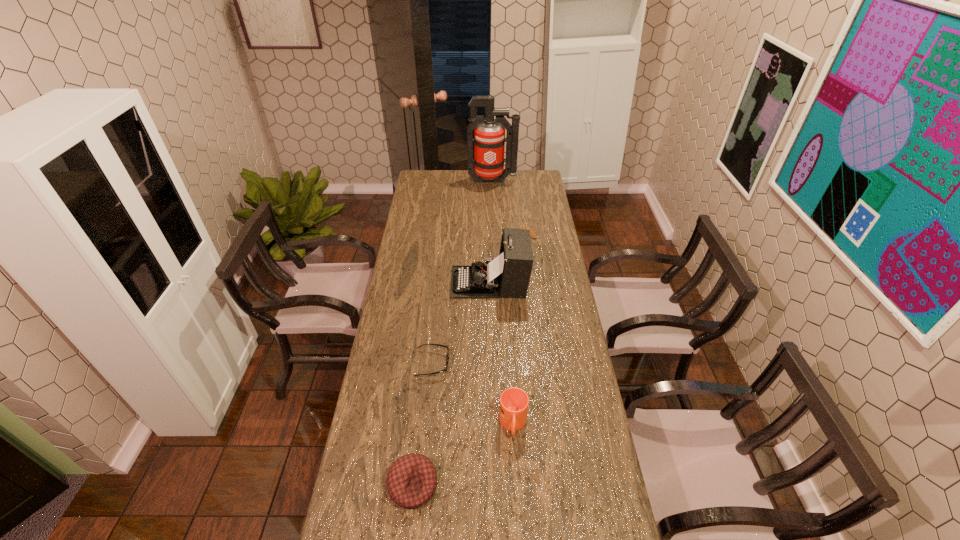
The image size is (960, 540). What are the coordinates of `free location that satisfies the following two spatial constraints: 1. on the front side of the fifth tallest object; 2. on the front-facing side of the fourth farthest object` in the screenshot? It's located at (542, 363).